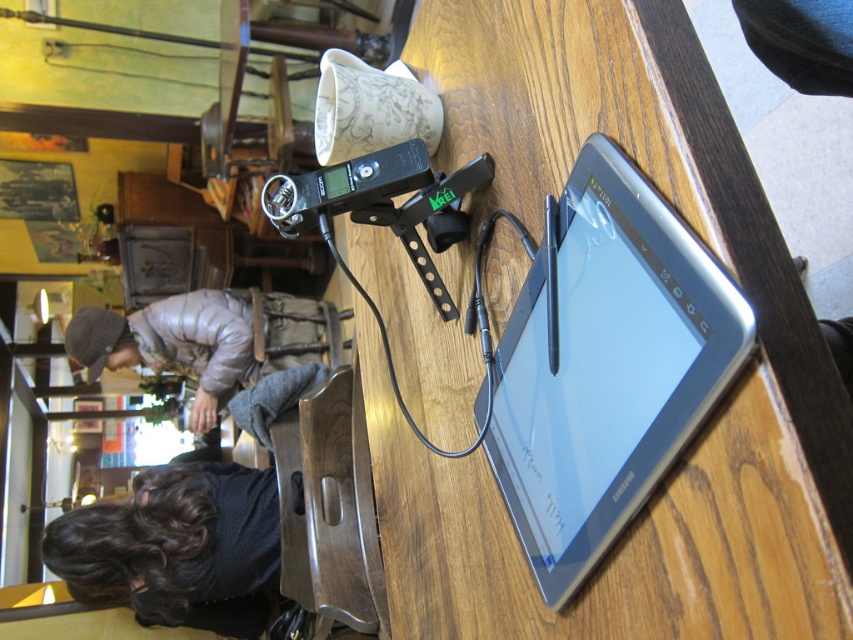
Looking at this image, you are a customer sitting at the wooden table at center and want to reach the gray down jacket at lower left. Is the jacket within easy reach from your current position?

The wooden table at center is closer to the viewer than the gray down jacket at lower left, so the jacket is farther away and may not be easily reachable from your current position at the wooden table at center.

What is located at the coordinates point (711, 416) in the image?

The wooden table at center is located at point (711, 416).

From the picture: What object is located at the coordinate point [607,365] in the image?

The silver metallic tablet at center is located at the coordinate point [607,365].